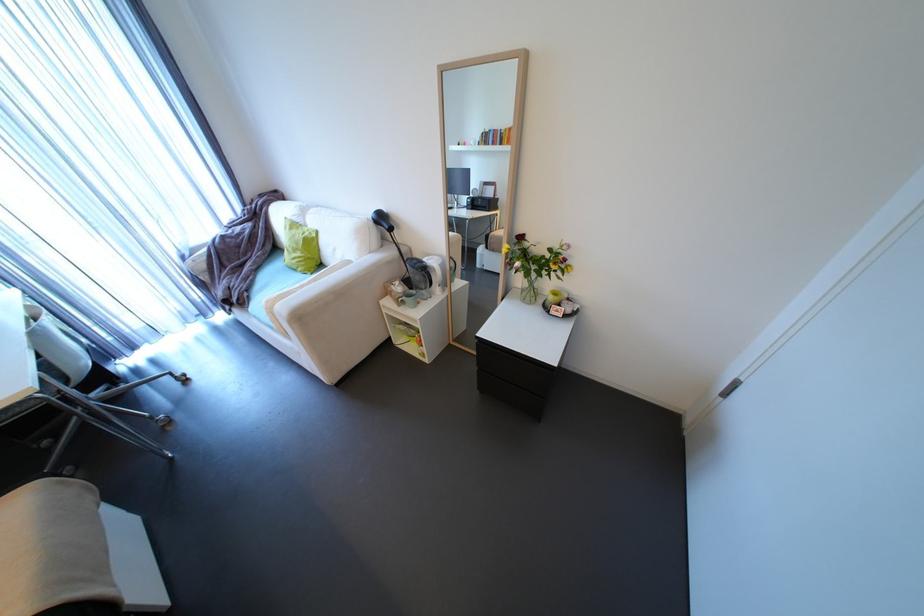
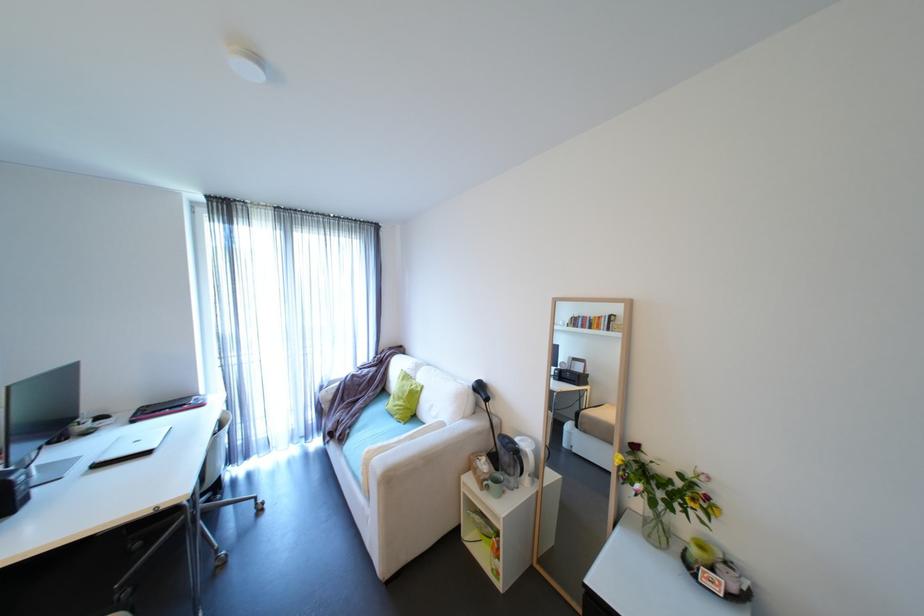
The point at (566, 254) is marked in the first image. Where is the corresponding point in the second image?

(703, 485)